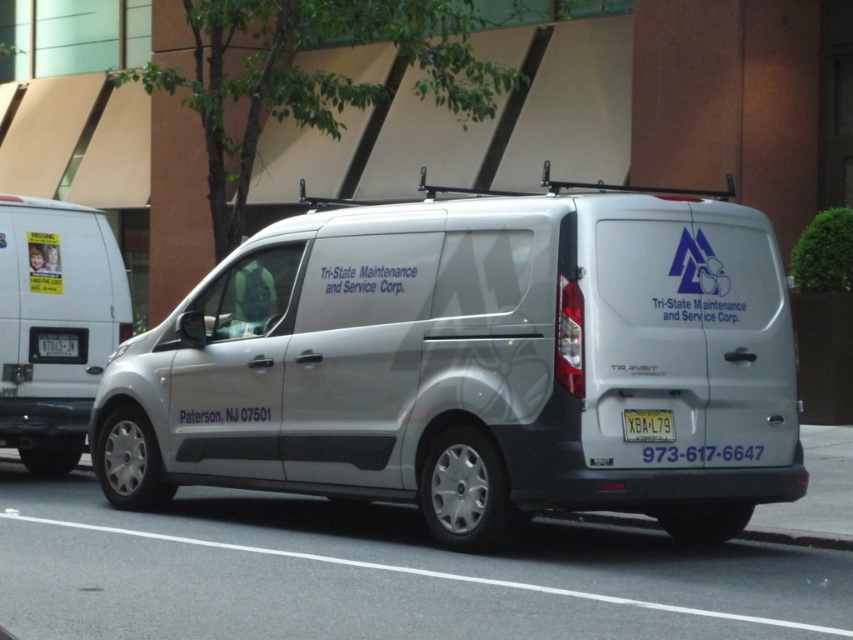
Question: Which object is closer to the camera taking this photo?

Choices:
 (A) yellow matte license plate at center
 (B) white matte van at left
 (C) yellow matte license plate at rear
 (D) silver metallic van at center

Answer: (D)

Question: Which point is closer to the camera taking this photo?

Choices:
 (A) (67, 349)
 (B) (190, 406)
 (C) (50, 436)

Answer: (B)

Question: Does white matte van at left have a smaller size compared to yellow matte license plate at rear?

Choices:
 (A) no
 (B) yes

Answer: (A)

Question: From the image, what is the correct spatial relationship of silver metallic van at center in relation to yellow matte license plate at rear?

Choices:
 (A) left
 (B) right

Answer: (B)

Question: Does white matte van at left appear on the left side of yellow matte license plate at center?

Choices:
 (A) yes
 (B) no

Answer: (A)

Question: Which point is farther to the camera?

Choices:
 (A) (49, 348)
 (B) (659, 420)
 (C) (294, 396)

Answer: (A)